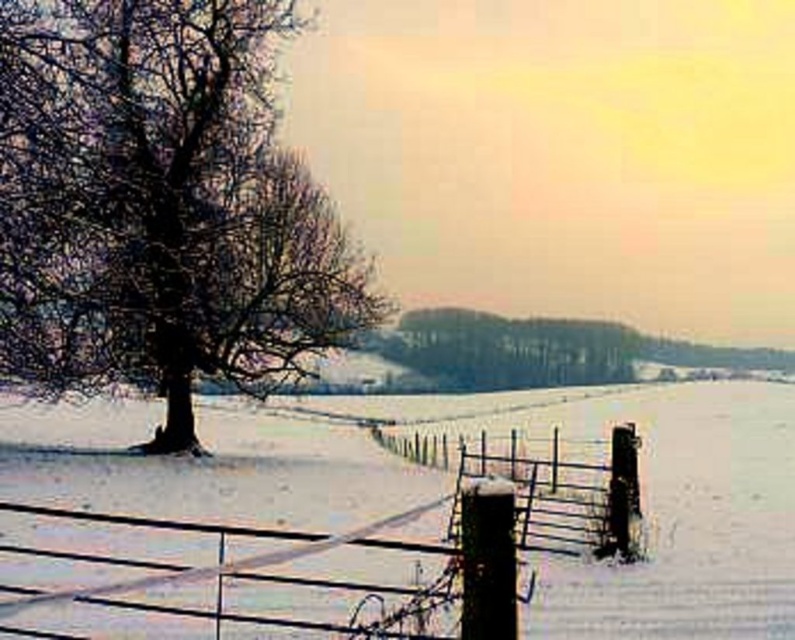
In the scene shown: You are standing at the point labeled point (681, 515) in the winter scene. What do you see immediately around you?

You see white frosty snow at center immediately around you at point (681, 515).